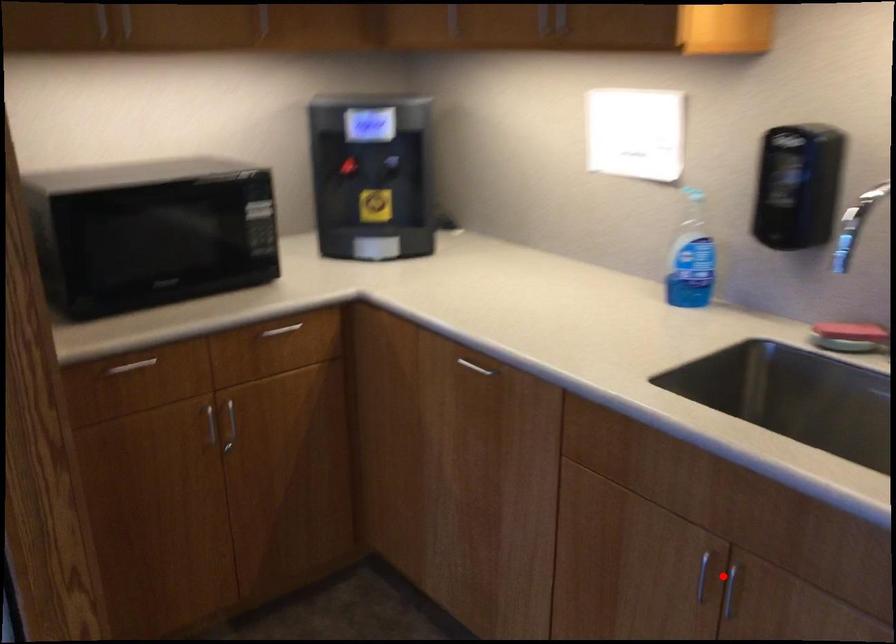
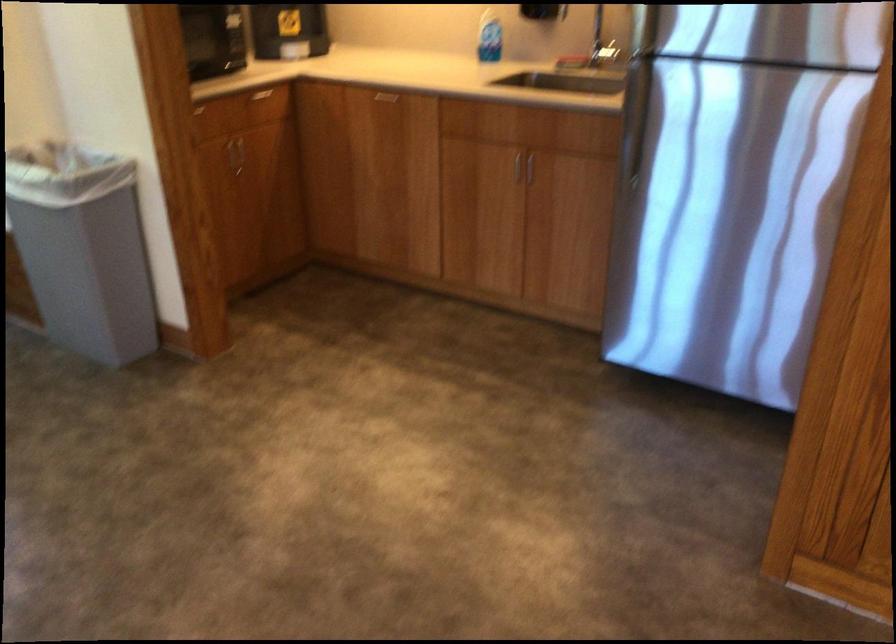
Question: I am providing you with two images of the same scene from different viewpoints. In image1, a red point is highlighted. Considering the same 3D point in image2, which of the following is correct?

Choices:
 (A) It is closer
 (B) It is farther

Answer: (B)